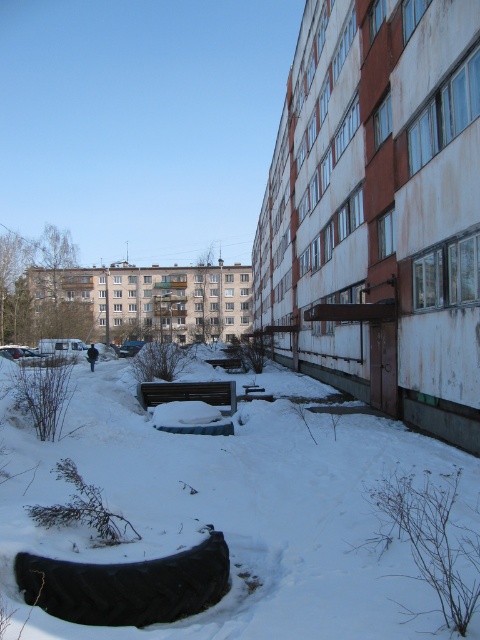
Is point (296, 529) more distant than point (159, 566)?

Yes, it is.

You are a GUI agent. You are given a task and a screenshot of the screen. Output one action in this format:
    pyautogui.click(x=<x>, y=<y>)
    Task: Click on the white fluffy snow at center
    The width and height of the screenshot is (480, 640).
    Given the screenshot: What is the action you would take?
    pyautogui.click(x=231, y=508)

Is point (324, 452) less distant than point (28, 556)?

No, it is behind (28, 556).

Find the location of a particular element. Image resolution: width=480 pixels, height=640 pixels. white fluffy snow at center is located at coordinates (231, 508).